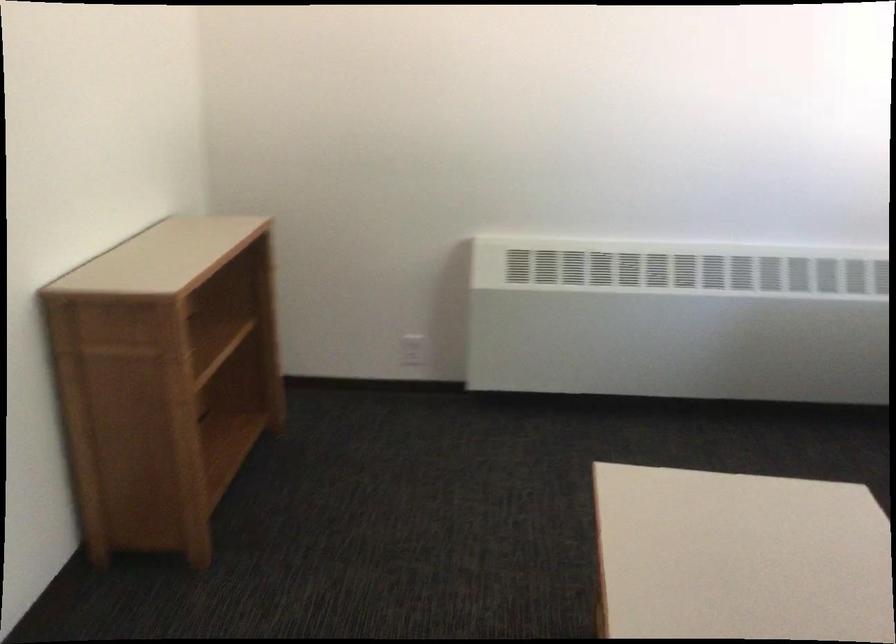
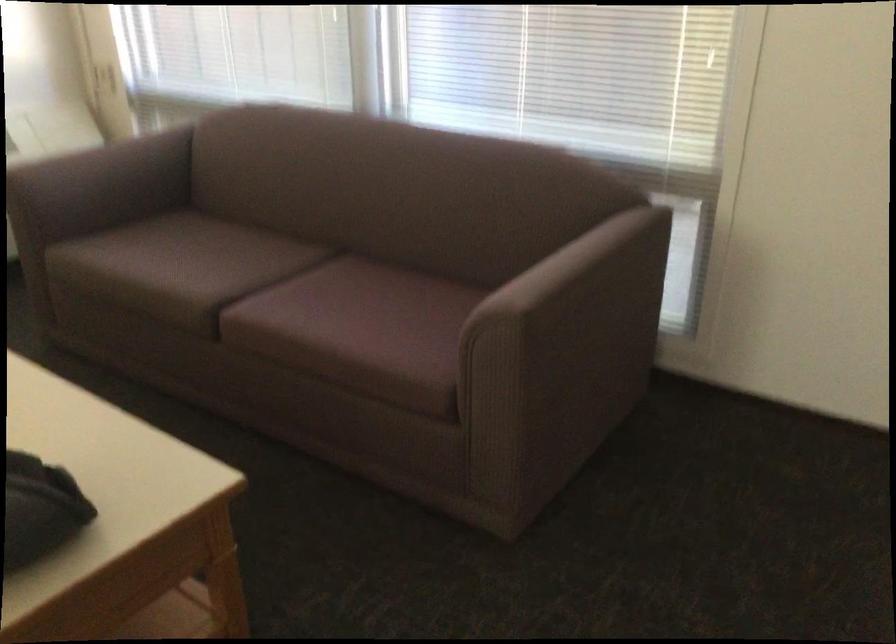
How did the camera likely rotate?

The camera's rotation is toward right-down.